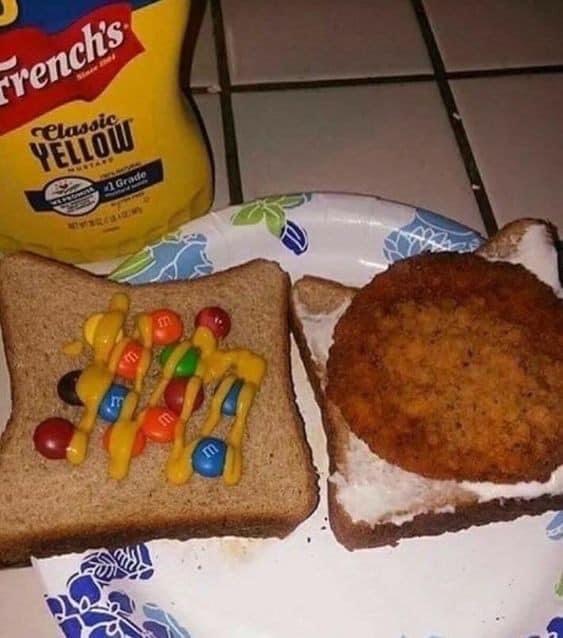
This screenshot has width=563, height=638. Find the location of `tiled counter`. tiled counter is located at coordinates (31, 614), (516, 161), (379, 26), (245, 126).